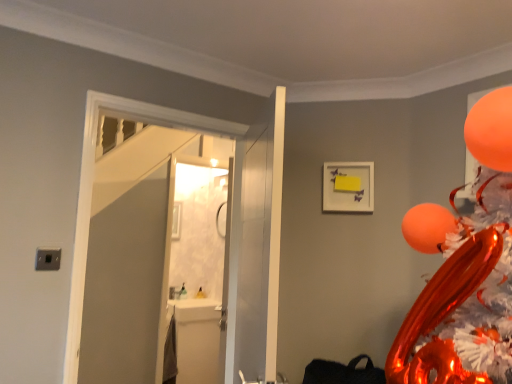
Question: Is white glossy door at center, the 2th door when ordered from left to right, taller than orange glossy balloon at upper right?

Choices:
 (A) yes
 (B) no

Answer: (A)

Question: Can you confirm if white glossy door at center, the 2th door when ordered from left to right, is positioned to the left of orange glossy balloon at upper right?

Choices:
 (A) no
 (B) yes

Answer: (B)

Question: Does white glossy door at center, the 1th door in the right-to-left sequence, have a larger size compared to orange glossy balloon at upper right?

Choices:
 (A) no
 (B) yes

Answer: (B)

Question: Is white glossy door at center, the 2th door when ordered from left to right, turned away from orange glossy balloon at upper right?

Choices:
 (A) yes
 (B) no

Answer: (A)

Question: From the image's perspective, would you say white glossy door at center, the 1th door in the right-to-left sequence, is positioned over orange glossy balloon at upper right?

Choices:
 (A) no
 (B) yes

Answer: (A)

Question: Based on their sizes in the image, would you say white matte picture frame at upper center is bigger or smaller than white glossy sink at lower left?

Choices:
 (A) big
 (B) small

Answer: (B)

Question: From the image's perspective, is white matte picture frame at upper center located above or below white glossy sink at lower left?

Choices:
 (A) below
 (B) above

Answer: (B)

Question: Choose the correct answer: Is white matte picture frame at upper center inside white glossy sink at lower left or outside it?

Choices:
 (A) inside
 (B) outside

Answer: (B)

Question: From a real-world perspective, is white matte picture frame at upper center physically located above or below white glossy sink at lower left?

Choices:
 (A) above
 (B) below

Answer: (A)

Question: Based on their sizes in the image, would you say white matte picture frame at upper center is bigger or smaller than white glossy door at center, the second door when ordered from right to left?

Choices:
 (A) big
 (B) small

Answer: (B)

Question: Is white matte picture frame at upper center spatially inside white glossy door at center, which is the 1th door from left to right, or outside of it?

Choices:
 (A) inside
 (B) outside

Answer: (B)

Question: From a real-world perspective, relative to white glossy door at center, the second door when ordered from right to left, is white matte picture frame at upper center vertically above or below?

Choices:
 (A) above
 (B) below

Answer: (A)

Question: From their relative heights in the image, would you say white matte picture frame at upper center is taller or shorter than white glossy door at center, which is the 1th door from left to right?

Choices:
 (A) tall
 (B) short

Answer: (B)

Question: Would you say white matte picture frame at upper center is inside or outside orange glossy balloon at upper right?

Choices:
 (A) inside
 (B) outside

Answer: (B)

Question: Is white matte picture frame at upper center bigger or smaller than orange glossy balloon at upper right?

Choices:
 (A) small
 (B) big

Answer: (A)